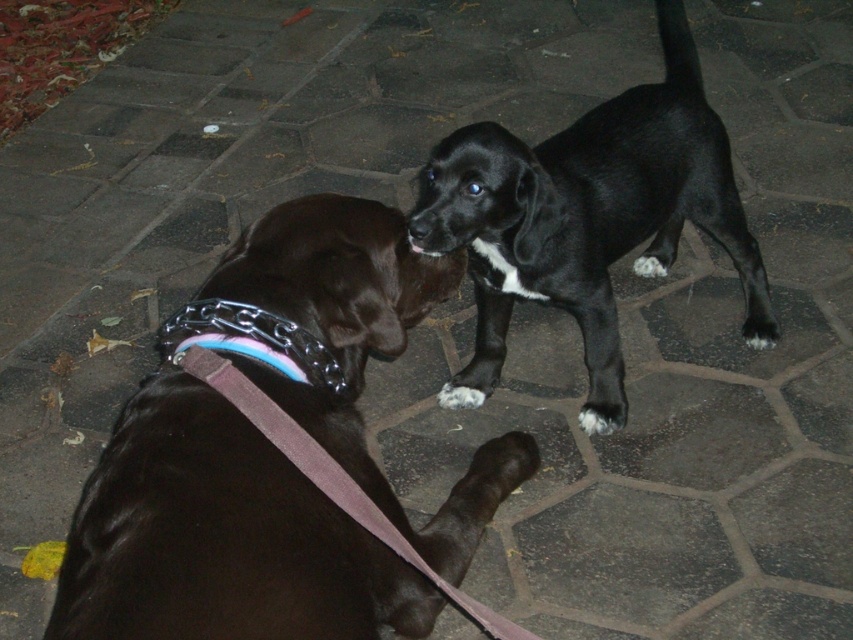
Question: Is black glossy fur at upper right wider than purple fabric leash at lower center?

Choices:
 (A) yes
 (B) no

Answer: (A)

Question: Is black glossy fur at upper right to the left of metallic chain at center from the viewer's perspective?

Choices:
 (A) no
 (B) yes

Answer: (A)

Question: Which point is closer to the camera taking this photo?

Choices:
 (A) (263, 540)
 (B) (265, 358)

Answer: (A)

Question: In this image, where is shiny black dog at center located relative to black glossy fur at upper right?

Choices:
 (A) below
 (B) above

Answer: (A)

Question: Which point appears closest to the camera in this image?

Choices:
 (A) pos(363,634)
 (B) pos(351,508)
 (C) pos(476,243)

Answer: (B)

Question: Among these objects, which one is nearest to the camera?

Choices:
 (A) purple fabric leash at lower center
 (B) black glossy fur at upper right
 (C) metallic chain at center

Answer: (A)